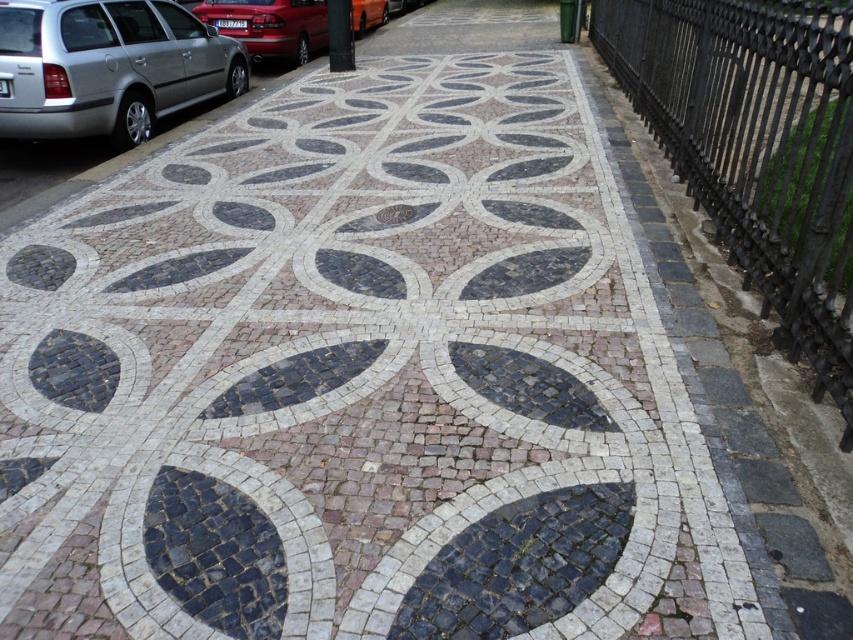
Question: Which of these objects is positioned farthest from the metallic red car at upper left?

Choices:
 (A) silver metallic car at left
 (B) black wrought iron fence at right
 (C) dark gray mosaic leaf at center

Answer: (C)

Question: Which object appears farthest from the camera in this image?

Choices:
 (A) metallic red car at upper left
 (B) black wrought iron fence at right

Answer: (A)

Question: Among these objects, which one is nearest to the camera?

Choices:
 (A) silver metallic car at left
 (B) black wrought iron fence at right

Answer: (B)

Question: Is dark gray mosaic leaf at center closer to the viewer compared to silver metallic car at left?

Choices:
 (A) yes
 (B) no

Answer: (A)

Question: Does black wrought iron fence at right have a lesser width compared to metallic red car at upper left?

Choices:
 (A) yes
 (B) no

Answer: (A)

Question: Is the position of silver metallic car at left more distant than that of metallic red car at upper left?

Choices:
 (A) no
 (B) yes

Answer: (A)